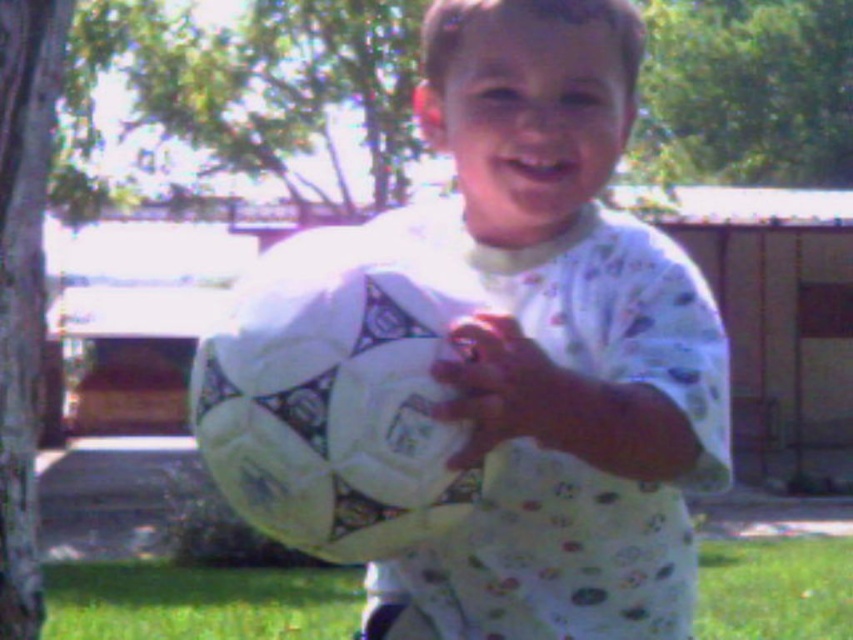
You are a photographer adjusting your camera settings to focus on the green grass at lower center and the smooth white glove at center. Which object should you focus on first if you want to capture both in sharp detail?

The green grass at lower center is further to the viewer than the smooth white glove at center, so you should focus on the smooth white glove at center first to ensure both are in sharp detail.

In the scene shown: The child is holding a white matte soccer ball at center and a smooth white glove at center. Which object is closer to the viewer?

The white matte soccer ball at center is closer to the viewer than the smooth white glove at center because it is positioned over it.